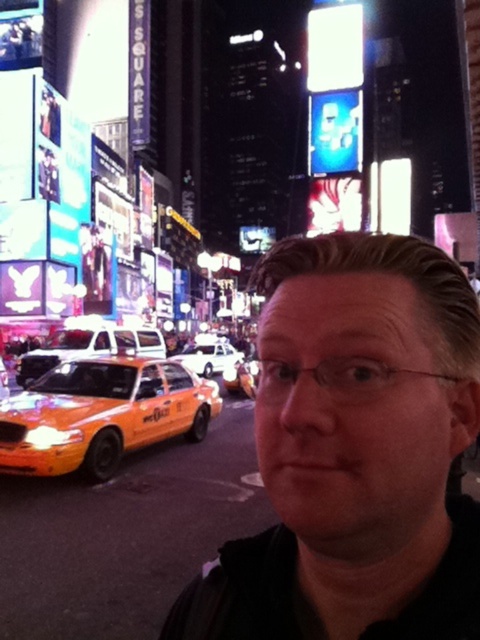
Describe the element at coordinates (356, 451) in the screenshot. I see `black matte man at center` at that location.

Does black matte man at center appear on the left side of orange matte taxi at lower left?

In fact, black matte man at center is to the right of orange matte taxi at lower left.

Does point (382, 390) come in front of point (131, 388)?

That is True.

At what (x,y) coordinates should I click in order to perform the action: click on black matte man at center. Please return your answer as a coordinate pair (x, y). The image size is (480, 640). Looking at the image, I should click on (356, 451).

Does orange matte taxi at lower left appear on the right side of white glossy sedan at center?

Incorrect, orange matte taxi at lower left is not on the right side of white glossy sedan at center.

Is orange matte taxi at lower left above white glossy sedan at center?

No.

Is point (81, 380) in front of point (214, 342)?

Yes, it is in front of point (214, 342).

Where is `orange matte taxi at lower left`? Image resolution: width=480 pixels, height=640 pixels. orange matte taxi at lower left is located at coordinates (101, 413).

Does black matte man at center have a greater width compared to white glossy sedan at center?

Indeed, black matte man at center has a greater width compared to white glossy sedan at center.

Is black matte man at center to the right of white glossy sedan at center from the viewer's perspective?

Indeed, black matte man at center is positioned on the right side of white glossy sedan at center.

The height and width of the screenshot is (640, 480). In order to click on black matte man at center in this screenshot , I will do `click(356, 451)`.

Identify the location of black matte man at center. (356, 451).